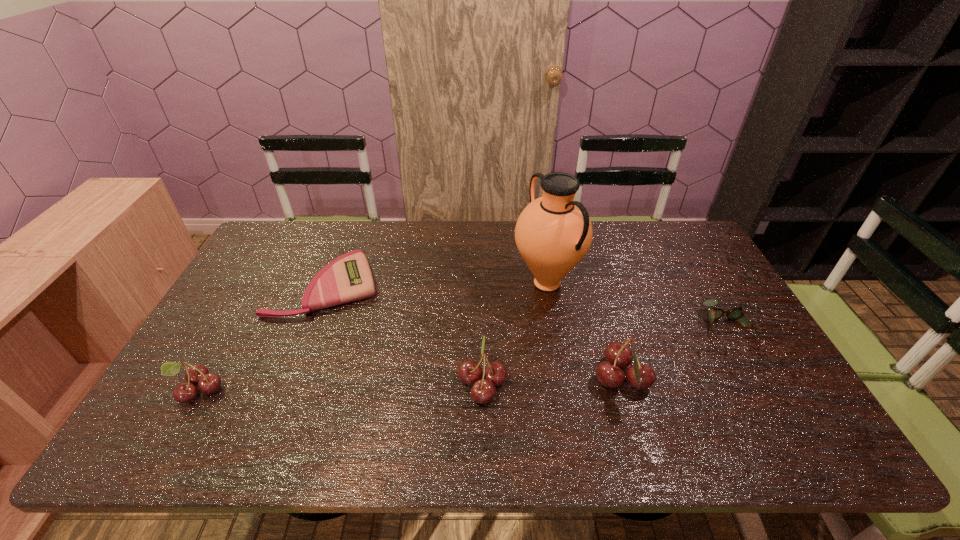
The width and height of the screenshot is (960, 540). I want to click on object that is at the right edge, so tap(736, 313).

You are a GUI agent. You are given a task and a screenshot of the screen. Output one action in this format:
    pyautogui.click(x=<x>, y=<y>)
    Task: Click on the object that is at the far left corner
    The width and height of the screenshot is (960, 540).
    Given the screenshot: What is the action you would take?
    tap(348, 278)

Identify the location of object that is at the near left corner. This screenshot has width=960, height=540. (197, 374).

What are the coordinates of `free space at the far edge of the desktop` in the screenshot? It's located at 389,262.

Locate an element on the screen. This screenshot has width=960, height=540. blank space at the near edge of the desktop is located at coordinates (426, 407).

Locate an element on the screen. This screenshot has width=960, height=540. vacant region at the left edge of the desktop is located at coordinates (228, 338).

The width and height of the screenshot is (960, 540). In the image, there is a desktop. What are the coordinates of `free region at the right edge` in the screenshot? It's located at (684, 263).

At what (x,y) coordinates should I click in order to perform the action: click on free location at the far left corner. Please return your answer as a coordinate pair (x, y). This screenshot has width=960, height=540. Looking at the image, I should click on (268, 239).

In the image, there is a desktop. Identify the location of vacant space at the near left corner. coord(182,403).

Identify the location of vacant area between the tallest object and the fifth tallest object. The width and height of the screenshot is (960, 540). (637, 306).